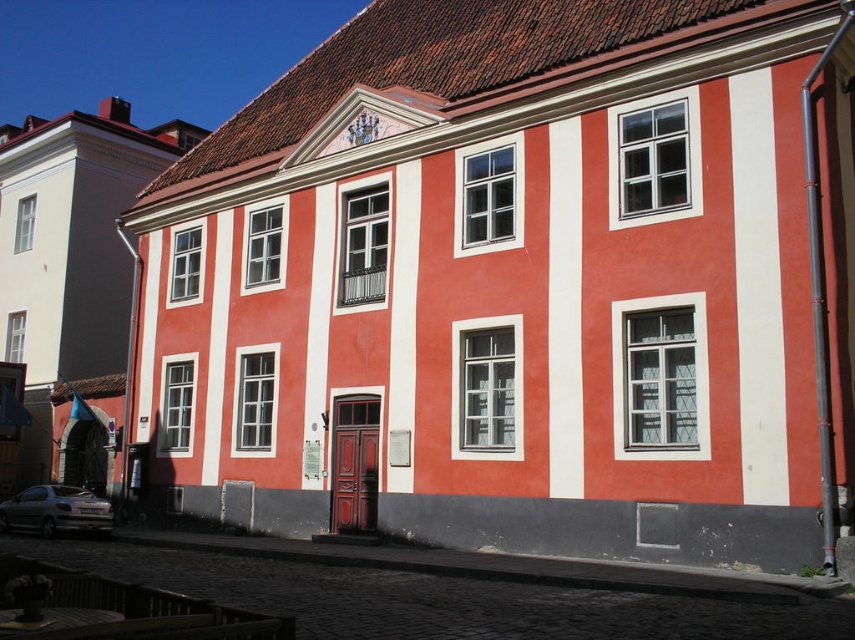
Which is in front, point (749, 177) or point (555, 490)?

Point (749, 177)

Is white matte stripe at right above red matte stripe at center?

Indeed, white matte stripe at right is positioned over red matte stripe at center.

At what (x,y) coordinates should I click in order to perform the action: click on white matte stripe at right. Please return your answer as a coordinate pair (x, y). Looking at the image, I should click on (758, 291).

At what (x,y) coordinates should I click in order to perform the action: click on white matte stripe at right. Please return your answer as a coordinate pair (x, y). The height and width of the screenshot is (640, 855). Looking at the image, I should click on (758, 291).

Does red matte stripe at center have a lesser height compared to matte silver car at lower left?

In fact, red matte stripe at center may be taller than matte silver car at lower left.

Is red matte stripe at center to the right of matte silver car at lower left from the viewer's perspective?

Yes, red matte stripe at center is to the right of matte silver car at lower left.

Does point (563, 164) lie behind point (75, 486)?

That is False.

In order to click on red matte stripe at center in this screenshot , I will do point(564,310).

Can you confirm if white matte stripe at right is positioned to the left of matte silver car at lower left?

In fact, white matte stripe at right is to the right of matte silver car at lower left.

Find the location of `white matte stripe at right`. white matte stripe at right is located at coordinates (758, 291).

Locate an element on the screen. This screenshot has height=640, width=855. white matte stripe at right is located at coordinates (758, 291).